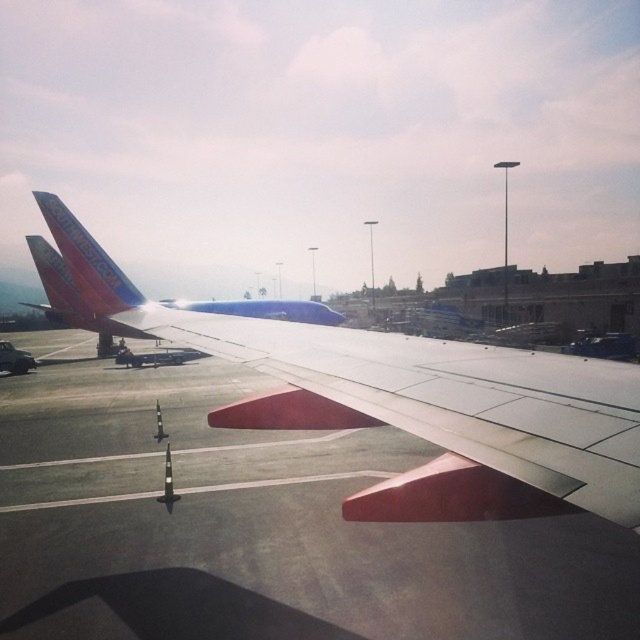
From the picture: You are a flight attendant on an airplane. You notice two objects in the scene from your window seat. Which object is taller between the smooth concrete tarmac at center and the matte white wing at center?

The matte white wing at center is taller than the smooth concrete tarmac at center.

You are a flight attendant on an airplane. You want to know if the smooth concrete tarmac at center is larger than the matte white wing at center in the image. Based on the scene, what can you conclude?

The smooth concrete tarmac at center occupies less space than the matte white wing at center, so the matte white wing at center is larger in the image.

You are a flight attendant who needs to check the distance between the smooth concrete tarmac at center and the matte white wing at center. Can you determine which one is closer to the airplane cabin?

The smooth concrete tarmac at center is positioned under matte white wing at center, so the matte white wing at center is closer to the airplane cabin than the tarmac.